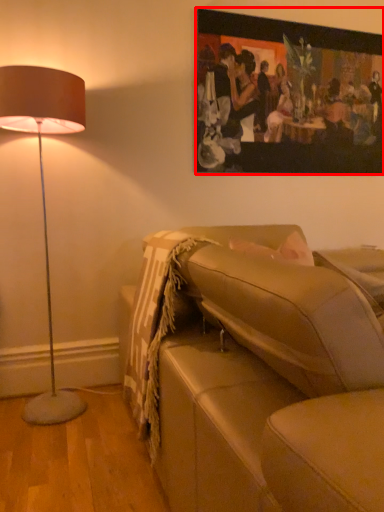
Question: From the image's perspective, where is picture frame (annotated by the red box) located relative to studio couch?

Choices:
 (A) above
 (B) below

Answer: (A)